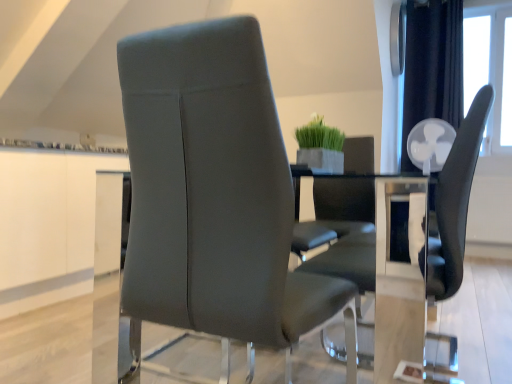
What do you see at coordinates (490, 70) in the screenshot? The width and height of the screenshot is (512, 384). I see `transparent glass window at upper right` at bounding box center [490, 70].

Measure the distance between matte black chair at center, marked as the 1th chair in a right-to-left arrangement, and camera.

matte black chair at center, marked as the 1th chair in a right-to-left arrangement, and camera are 34.40 inches apart from each other.

What do you see at coordinates (418, 252) in the screenshot? Image resolution: width=512 pixels, height=384 pixels. I see `matte black chair at center, placed as the 2th chair when sorted from left to right` at bounding box center [418, 252].

This screenshot has width=512, height=384. I want to click on satin gray leather chair at center, the 2th chair when ordered from right to left, so click(215, 194).

Is satin gray leather chair at center, the first chair viewed from the left, shorter than green matte plant at center?

In fact, satin gray leather chair at center, the first chair viewed from the left, may be taller than green matte plant at center.

Does satin gray leather chair at center, the 2th chair when ordered from right to left, appear on the right side of green matte plant at center?

No, satin gray leather chair at center, the 2th chair when ordered from right to left, is not to the right of green matte plant at center.

In the scene shown: From the image's perspective, is satin gray leather chair at center, the 2th chair when ordered from right to left, positioned above or below green matte plant at center?

satin gray leather chair at center, the 2th chair when ordered from right to left, is below green matte plant at center.

Is satin gray leather chair at center, the first chair viewed from the left, positioned beyond the bounds of green matte plant at center?

Yes, satin gray leather chair at center, the first chair viewed from the left, is located beyond the bounds of green matte plant at center.

Considering the relative sizes of transparent glass window at upper right and matte black chair at center, placed as the 2th chair when sorted from left to right, in the image provided, is transparent glass window at upper right wider than matte black chair at center, placed as the 2th chair when sorted from left to right,?

No.

Is transparent glass window at upper right taller than matte black chair at center, placed as the 2th chair when sorted from left to right?

Correct, transparent glass window at upper right is much taller as matte black chair at center, placed as the 2th chair when sorted from left to right.

How different are the orientations of transparent glass window at upper right and matte black chair at center, placed as the 2th chair when sorted from left to right, in degrees?

89.7 degrees.

Can you see transparent glass window at upper right touching matte black chair at center, marked as the 1th chair in a right-to-left arrangement?

transparent glass window at upper right and matte black chair at center, marked as the 1th chair in a right-to-left arrangement, are clearly separated.

Can you tell me how much matte black chair at center, placed as the 2th chair when sorted from left to right, and satin gray leather chair at center, the 2th chair when ordered from right to left, differ in facing direction?

90.9 degrees.

From a real-world perspective, who is located higher, matte black chair at center, placed as the 2th chair when sorted from left to right, or satin gray leather chair at center, the first chair viewed from the left?

satin gray leather chair at center, the first chair viewed from the left.

From the image's perspective, who appears lower, matte black chair at center, marked as the 1th chair in a right-to-left arrangement, or satin gray leather chair at center, the 2th chair when ordered from right to left?

matte black chair at center, marked as the 1th chair in a right-to-left arrangement, from the image's perspective.

Is matte black chair at center, placed as the 2th chair when sorted from left to right, not within satin gray leather chair at center, the first chair viewed from the left?

Indeed, matte black chair at center, placed as the 2th chair when sorted from left to right, is completely outside satin gray leather chair at center, the first chair viewed from the left.

Considering the sizes of clear glass table at center and green matte plant at center in the image, is clear glass table at center taller or shorter than green matte plant at center?

clear glass table at center is taller than green matte plant at center.

From the image's perspective, is clear glass table at center located beneath green matte plant at center?

Yes.

Identify the location of plant above the clear glass table at center (from a real-world perspective). (319, 135).

Which object is thinner, clear glass table at center or green matte plant at center?

Thinner between the two is green matte plant at center.

Which is less distant, (310, 129) or (486, 87)?

Point (310, 129) is farther from the camera than point (486, 87).

From the image's perspective, which object appears higher, green matte plant at center or matte black chair at center, placed as the 2th chair when sorted from left to right?

green matte plant at center, from the image's perspective.

Between green matte plant at center and matte black chair at center, placed as the 2th chair when sorted from left to right, which one is positioned in front?

matte black chair at center, placed as the 2th chair when sorted from left to right, is closer to the camera.

Consider the image. Looking at their sizes, would you say green matte plant at center is wider or thinner than clear glass table at center?

green matte plant at center is thinner than clear glass table at center.

Is green matte plant at center oriented away from clear glass table at center?

No, green matte plant at center is not facing away from clear glass table at center.

Considering the relative positions of green matte plant at center and clear glass table at center in the image provided, is green matte plant at center behind clear glass table at center?

Yes.

Is green matte plant at center inside or outside of clear glass table at center?

green matte plant at center is not enclosed by clear glass table at center.

Considering the relative sizes of transparent glass window at upper right and clear glass table at center in the image provided, is transparent glass window at upper right bigger than clear glass table at center?

No, transparent glass window at upper right is not bigger than clear glass table at center.

Would you consider transparent glass window at upper right to be distant from clear glass table at center?

Yes, transparent glass window at upper right and clear glass table at center are quite far apart.

Which object is thinner, transparent glass window at upper right or clear glass table at center?

Thinner between the two is transparent glass window at upper right.

From the image's perspective, is transparent glass window at upper right on top of clear glass table at center?

Correct, transparent glass window at upper right appears higher than clear glass table at center in the image.

The width and height of the screenshot is (512, 384). In order to click on chair lying on the left of green matte plant at center in this screenshot , I will do `click(215, 194)`.

Locate an element on the screen. This screenshot has width=512, height=384. the 2nd chair positioned below the transparent glass window at upper right (from a real-world perspective) is located at coordinates (418, 252).

Estimate the real-world distances between objects in this image. Which object is closer to clear glass table at center, matte black chair at center, placed as the 2th chair when sorted from left to right, or satin gray leather chair at center, the 2th chair when ordered from right to left?

matte black chair at center, placed as the 2th chair when sorted from left to right.

Which object lies further to the anchor point green matte plant at center, satin gray leather chair at center, the 2th chair when ordered from right to left, or transparent glass window at upper right?

transparent glass window at upper right.

From the image, which object appears to be nearer to matte black chair at center, marked as the 1th chair in a right-to-left arrangement, transparent glass window at upper right or green matte plant at center?

Based on the image, green matte plant at center appears to be nearer to matte black chair at center, marked as the 1th chair in a right-to-left arrangement.

From the image, which object appears to be nearer to satin gray leather chair at center, the 2th chair when ordered from right to left, green matte plant at center or matte black chair at center, placed as the 2th chair when sorted from left to right?

matte black chair at center, placed as the 2th chair when sorted from left to right, lies closer to satin gray leather chair at center, the 2th chair when ordered from right to left, than the other object.

Which object lies nearer to the anchor point transparent glass window at upper right, satin gray leather chair at center, the first chair viewed from the left, or clear glass table at center?

Among the two, clear glass table at center is located nearer to transparent glass window at upper right.

Based on their spatial positions, is transparent glass window at upper right or matte black chair at center, placed as the 2th chair when sorted from left to right, closer to satin gray leather chair at center, the first chair viewed from the left?

matte black chair at center, placed as the 2th chair when sorted from left to right, is positioned closer to the anchor satin gray leather chair at center, the first chair viewed from the left.

Based on their spatial positions, is matte black chair at center, placed as the 2th chair when sorted from left to right, or clear glass table at center further from satin gray leather chair at center, the 2th chair when ordered from right to left?

clear glass table at center is positioned further to the anchor satin gray leather chair at center, the 2th chair when ordered from right to left.

Based on their spatial positions, is green matte plant at center or clear glass table at center further from matte black chair at center, marked as the 1th chair in a right-to-left arrangement?

The object further to matte black chair at center, marked as the 1th chair in a right-to-left arrangement, is green matte plant at center.

Where is `chair between satin gray leather chair at center, the first chair viewed from the left, and green matte plant at center in the front-back direction`? The height and width of the screenshot is (384, 512). chair between satin gray leather chair at center, the first chair viewed from the left, and green matte plant at center in the front-back direction is located at coordinates (418, 252).

The width and height of the screenshot is (512, 384). Identify the location of table between satin gray leather chair at center, the 2th chair when ordered from right to left, and green matte plant at center in the front-back direction. (111, 220).

At what (x,y) coordinates should I click in order to perform the action: click on chair positioned between clear glass table at center and transparent glass window at upper right from near to far. Please return your answer as a coordinate pair (x, y). Looking at the image, I should click on (418, 252).

Where is `plant between matte black chair at center, marked as the 1th chair in a right-to-left arrangement, and transparent glass window at upper right in the front-back direction`? This screenshot has height=384, width=512. plant between matte black chair at center, marked as the 1th chair in a right-to-left arrangement, and transparent glass window at upper right in the front-back direction is located at coordinates (319, 135).